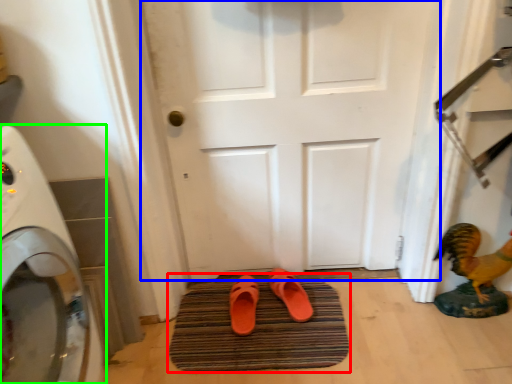
Question: Based on their relative distances, which object is nearer to bath mat (highlighted by a red box)? Choose from door (highlighted by a blue box) and home appliance (highlighted by a green box).

Choices:
 (A) door
 (B) home appliance

Answer: (A)